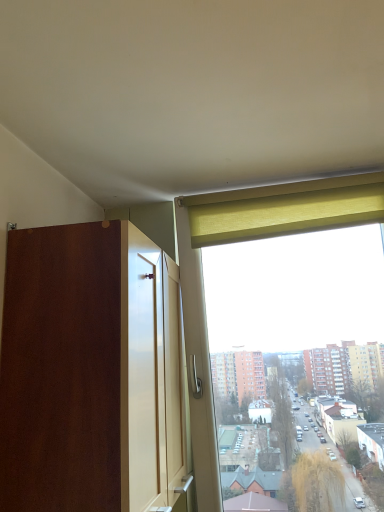
Question: Is green fabric curtain at upper right beside matte wood dresser at left?

Choices:
 (A) no
 (B) yes

Answer: (A)

Question: Can you confirm if green fabric curtain at upper right is positioned to the right of matte wood dresser at left?

Choices:
 (A) yes
 (B) no

Answer: (A)

Question: Is green fabric curtain at upper right positioned with its back to matte wood dresser at left?

Choices:
 (A) no
 (B) yes

Answer: (A)

Question: From the image's perspective, is green fabric curtain at upper right located above matte wood dresser at left?

Choices:
 (A) yes
 (B) no

Answer: (A)

Question: Is green fabric curtain at upper right located outside matte wood dresser at left?

Choices:
 (A) no
 (B) yes

Answer: (B)

Question: Would you say green fabric curtain at upper right contains matte wood dresser at left?

Choices:
 (A) no
 (B) yes

Answer: (A)

Question: Can you confirm if matte wood dresser at left is thinner than green fabric curtain at upper right?

Choices:
 (A) no
 (B) yes

Answer: (A)

Question: Is matte wood dresser at left at the left side of green fabric curtain at upper right?

Choices:
 (A) yes
 (B) no

Answer: (A)

Question: Is matte wood dresser at left bigger than green fabric curtain at upper right?

Choices:
 (A) yes
 (B) no

Answer: (A)

Question: Is matte wood dresser at left oriented away from green fabric curtain at upper right?

Choices:
 (A) yes
 (B) no

Answer: (B)

Question: Does matte wood dresser at left have a smaller size compared to green fabric curtain at upper right?

Choices:
 (A) yes
 (B) no

Answer: (B)

Question: Is matte wood dresser at left closer to camera compared to green fabric curtain at upper right?

Choices:
 (A) yes
 (B) no

Answer: (A)

Question: From a real-world perspective, is matte wood dresser at left physically located above or below green fabric curtain at upper right?

Choices:
 (A) above
 (B) below

Answer: (B)